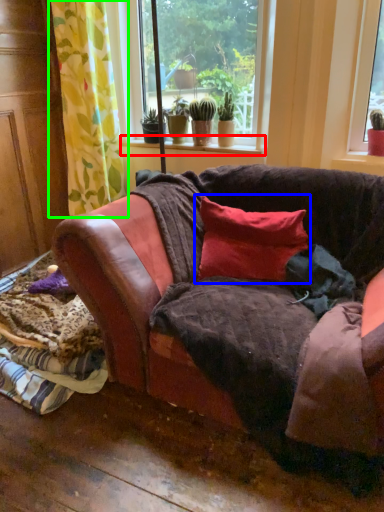
Question: Estimate the real-world distances between objects in this image. Which object is farther from window sill (highlighted by a red box), pillow (highlighted by a blue box) or curtain (highlighted by a green box)?

Choices:
 (A) pillow
 (B) curtain

Answer: (A)